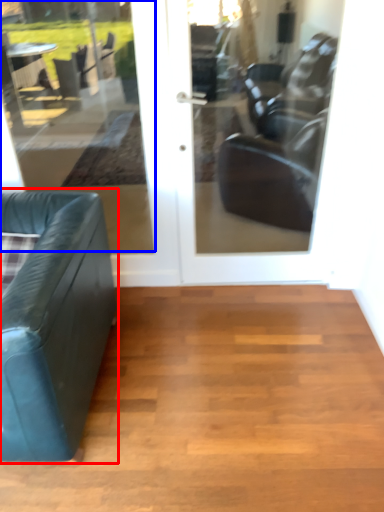
Question: Which object appears farthest to the camera in this image, studio couch (highlighted by a red box) or window (highlighted by a blue box)?

Choices:
 (A) studio couch
 (B) window

Answer: (B)